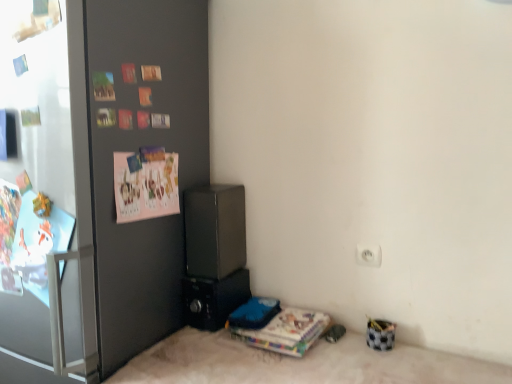
The height and width of the screenshot is (384, 512). I want to click on free space above satin black speaker at center, the first appliance positioned from the top (from a real-world perspective), so click(218, 187).